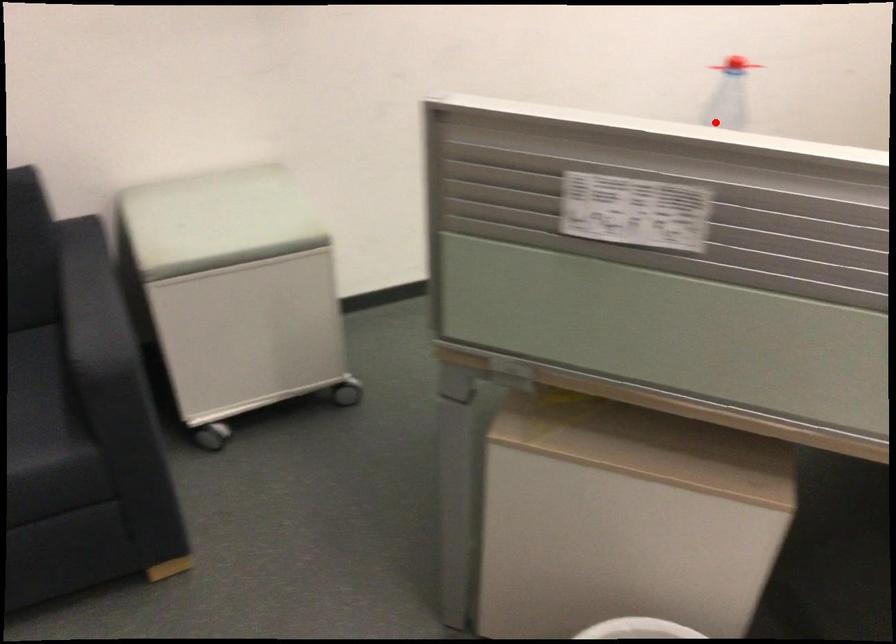
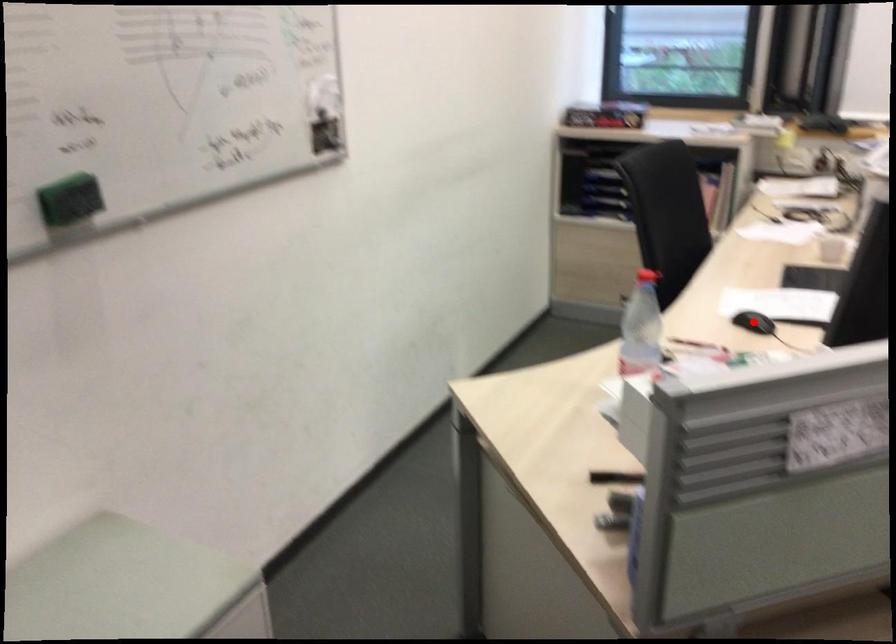
I am providing you with two images of the same scene from different viewpoints. A red point is marked on the first image and another point is marked on the second image. Do the highlighted points in image1 and image2 indicate the same real-world spot?

No